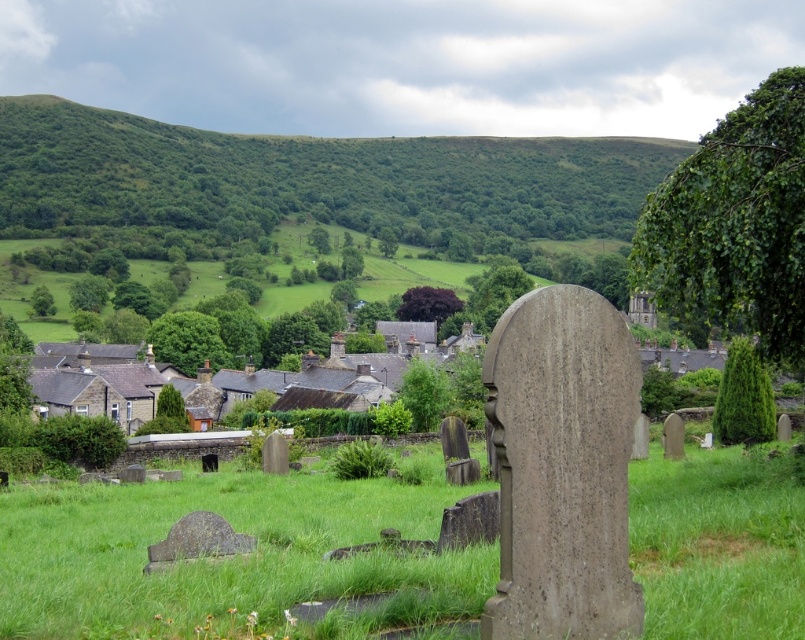
Question: Observing the image, what is the correct spatial positioning of green leafy tree at center in reference to green leafy tree at center-left?

Choices:
 (A) below
 (B) above

Answer: (A)

Question: Which object is closer to the camera taking this photo?

Choices:
 (A) purple leafy tree at center
 (B) green textured tree at right
 (C) green leafy branch at upper right

Answer: (C)

Question: From the image, what is the correct spatial relationship of green leafy branch at upper right in relation to green textured tree at right?

Choices:
 (A) left
 (B) right

Answer: (B)

Question: Among these points, which one is nearest to the camera?

Choices:
 (A) (77, 305)
 (B) (729, 413)
 (C) (460, 138)
 (D) (31, 296)

Answer: (B)

Question: Is green leafy hillside at upper center further to camera compared to green textured tree at right?

Choices:
 (A) no
 (B) yes

Answer: (B)

Question: Among these objects, which one is nearest to the camera?

Choices:
 (A) green leafy tree at center-left
 (B) green textured tree at right
 (C) green leafy tree at left

Answer: (B)